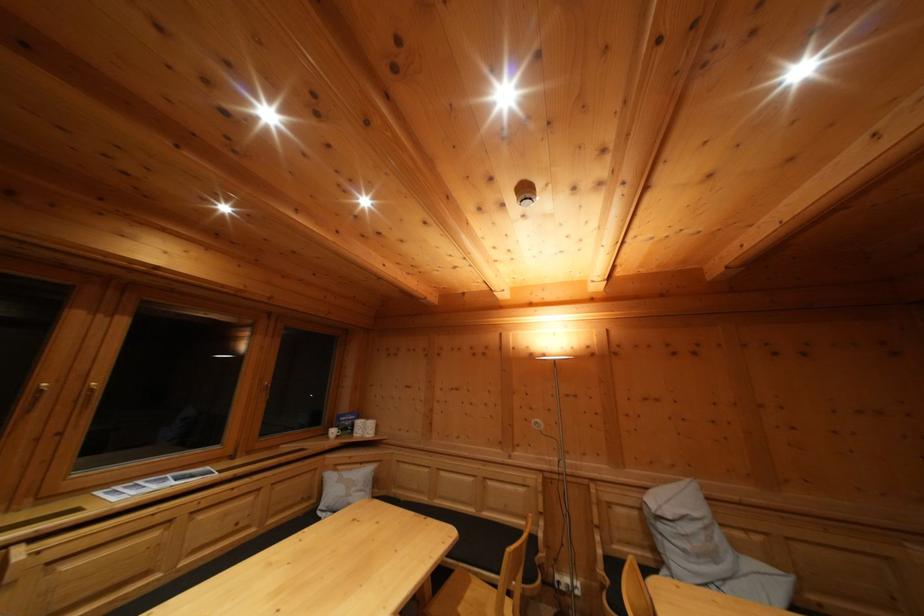
Find the location of a particular element. The image size is (924, 616). white lamp switch is located at coordinates (537, 424).